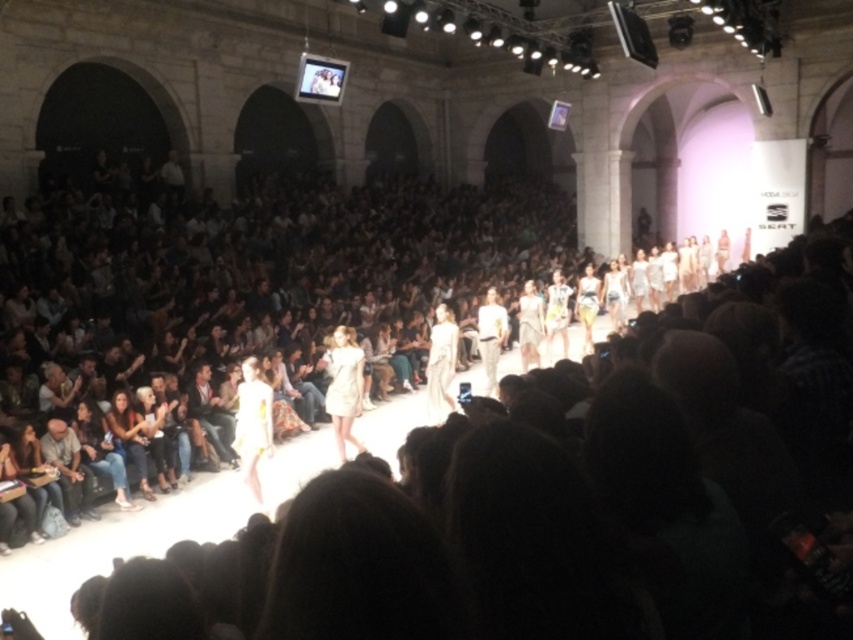
Question: Can you confirm if white matte dress at center is positioned below jeans at lower left?

Choices:
 (A) no
 (B) yes

Answer: (A)

Question: Which of the following is the farthest from the observer?

Choices:
 (A) (119, 492)
 (B) (479, 321)
 (C) (349, 376)
 (D) (120, 432)

Answer: (B)

Question: Among these points, which one is nearest to the camera?

Choices:
 (A) (102, 442)
 (B) (340, 420)
 (C) (129, 448)

Answer: (A)

Question: Does white matte dress at center have a lesser width compared to white cotton shirt at center?

Choices:
 (A) yes
 (B) no

Answer: (A)

Question: From the image, what is the correct spatial relationship of white matte dress at center in relation to white cotton shirt at center?

Choices:
 (A) above
 (B) below

Answer: (B)

Question: Estimate the real-world distances between objects in this image. Which object is farther from the light brown leather jacket at lower left?

Choices:
 (A) white cotton shirt at center
 (B) jeans at lower left

Answer: (A)